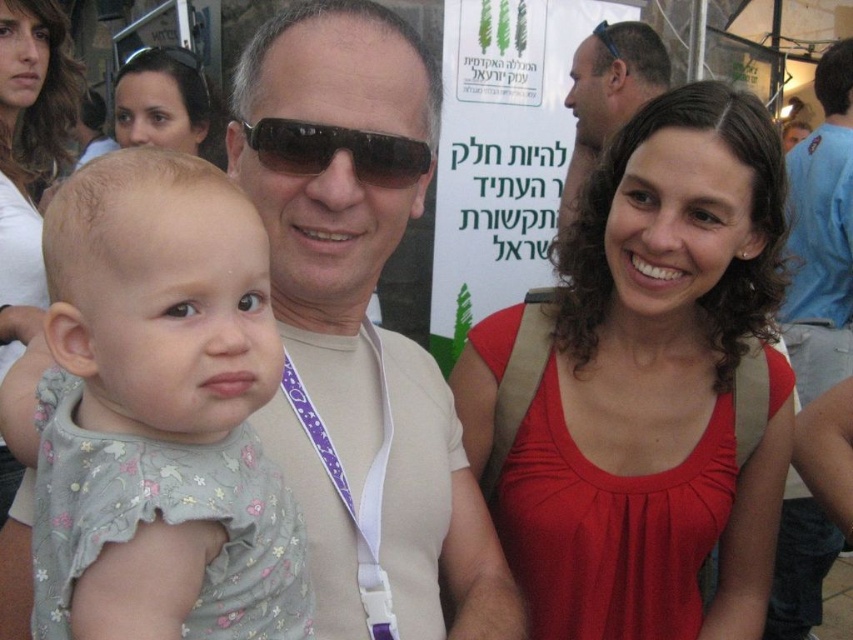
You are at a public event and see two people in the foreground. One is wearing a red matte tank top at center and the other a matte beige shirt at center. Which one is positioned to the right of the other?

The red matte tank top at center is positioned to the right of the matte beige shirt at center.

You are a photographer at the event and want to capture a closeup of the matte beige shirt at upper center without the matte black sunglasses at upper left being visible. Given their sizes, is this feasible?

The matte beige shirt at upper center is bigger than the matte black sunglasses at upper left, so it is possible to frame the shot to focus on the matte beige shirt at upper center while excluding the matte black sunglasses at upper left.

You are a photographer at the event and want to capture a closeup of the matte beige shirt at center without the matte black sunglasses at upper left appearing in the frame. Is this possible given their positions?

The matte beige shirt at center might be wider than matte black sunglasses at upper left, so there is a possibility that the sunglasses could be out of frame if the shirt is positioned wider. However, without exact measurements, it is uncertain if they can be fully excluded.